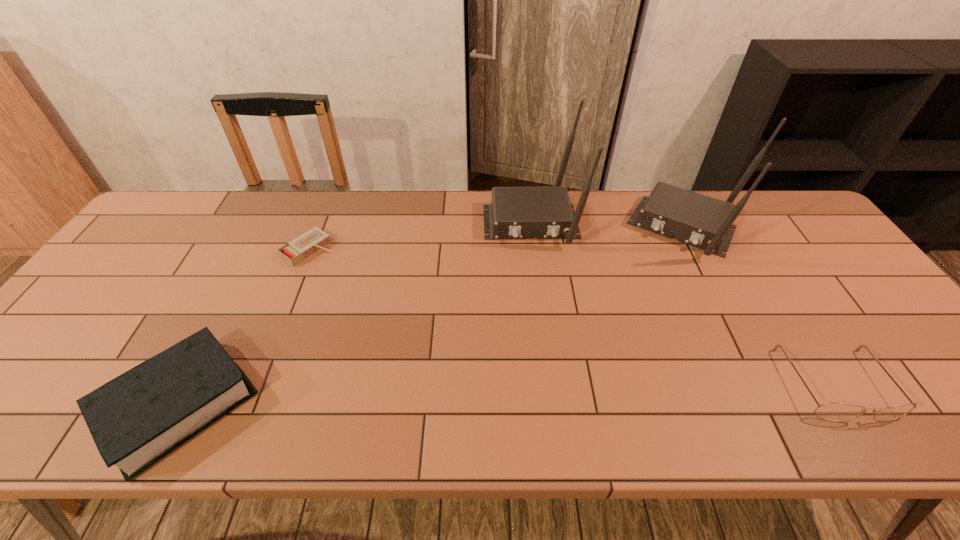
Where is `free space on the desktop that is between the Bible and the spectacles and is positioned on the back of the third object from right to left to connect cables`? The height and width of the screenshot is (540, 960). free space on the desktop that is between the Bible and the spectacles and is positioned on the back of the third object from right to left to connect cables is located at coordinates (555, 393).

Where is `vacant space on the desktop that is between the Bible and the second shortest object and is positioned on the striking surface of the shortest object`? The height and width of the screenshot is (540, 960). vacant space on the desktop that is between the Bible and the second shortest object and is positioned on the striking surface of the shortest object is located at coordinates coord(518,394).

This screenshot has height=540, width=960. Identify the location of vacant spot on the desktop that is between the third tallest object and the second shortest object and is positioned on the back of the right router to connect cables. (607, 391).